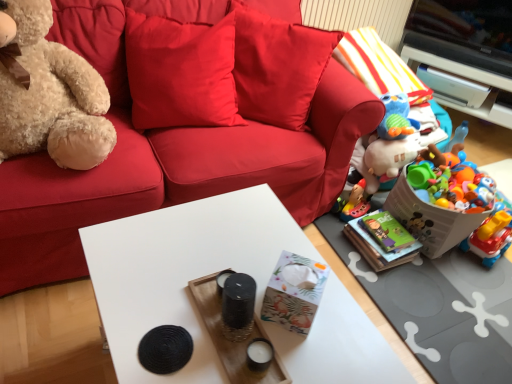
Locate an element on the screen. Image resolution: width=512 pixels, height=384 pixels. free space to the left of black woven coaster at lower center, positioned as the 3th toy in back-to-front order is located at coordinates (120, 317).